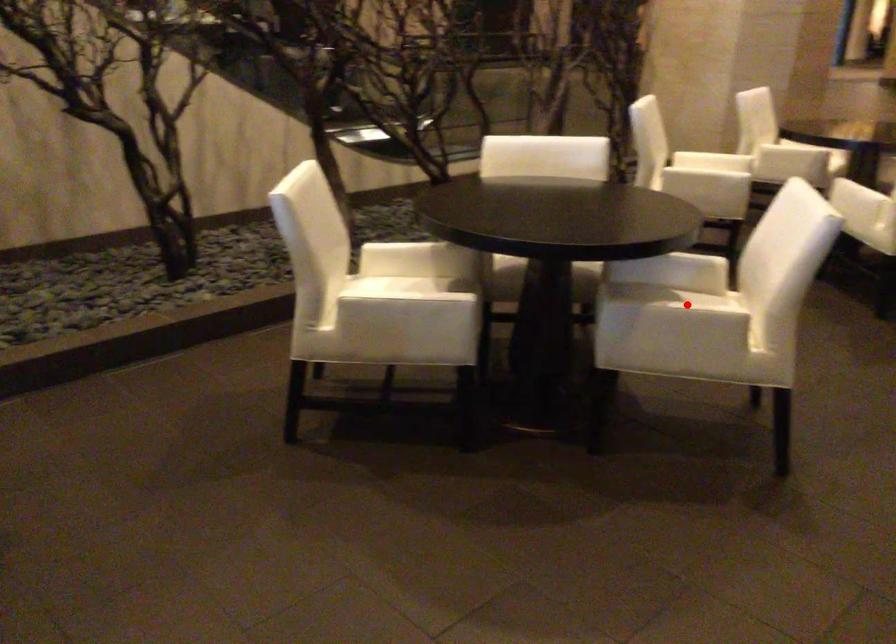
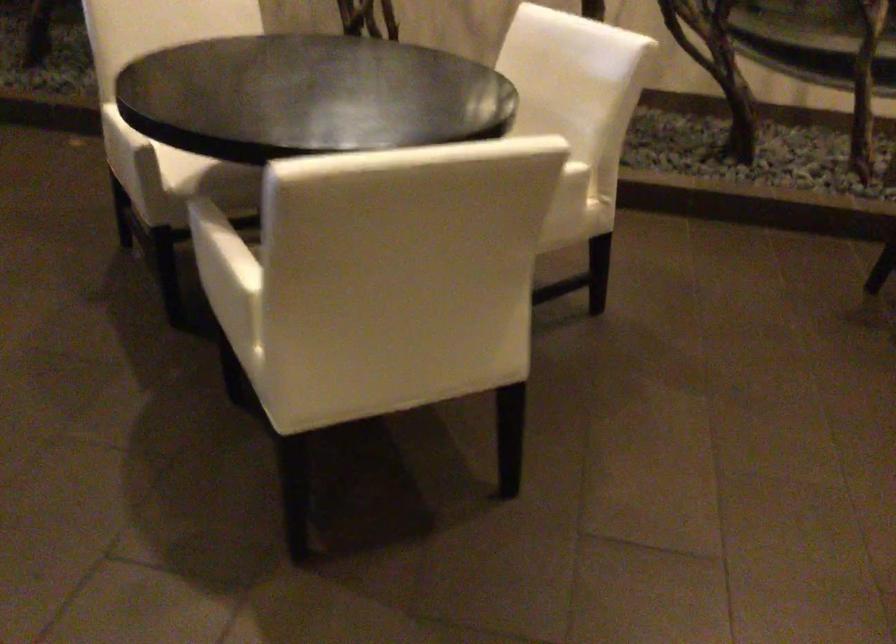
Where in the second image is the point corresponding to the highlighted location from the first image?

(220, 249)